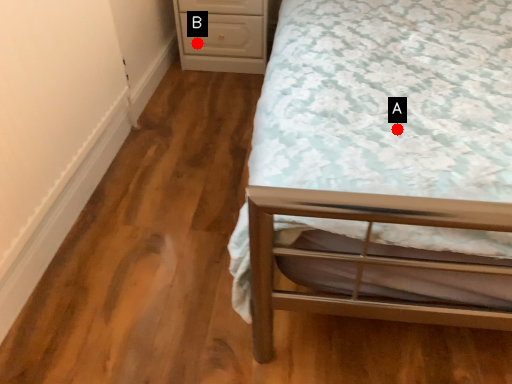
Question: Two points are circled on the image, labeled by A and B beside each circle. Which point appears closest to the camera in this image?

Choices:
 (A) A is closer
 (B) B is closer

Answer: (A)